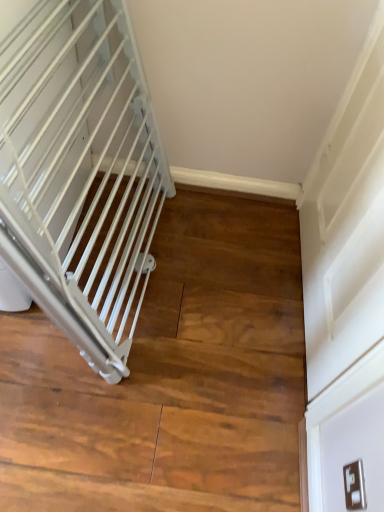
Image resolution: width=384 pixels, height=512 pixels. What do you see at coordinates (354, 486) in the screenshot? I see `metallic silver electric outlet at lower right` at bounding box center [354, 486].

Where is `metallic silver electric outlet at lower right`? The height and width of the screenshot is (512, 384). metallic silver electric outlet at lower right is located at coordinates (354, 486).

Image resolution: width=384 pixels, height=512 pixels. In order to click on metallic silver electric outlet at lower right in this screenshot , I will do pos(354,486).